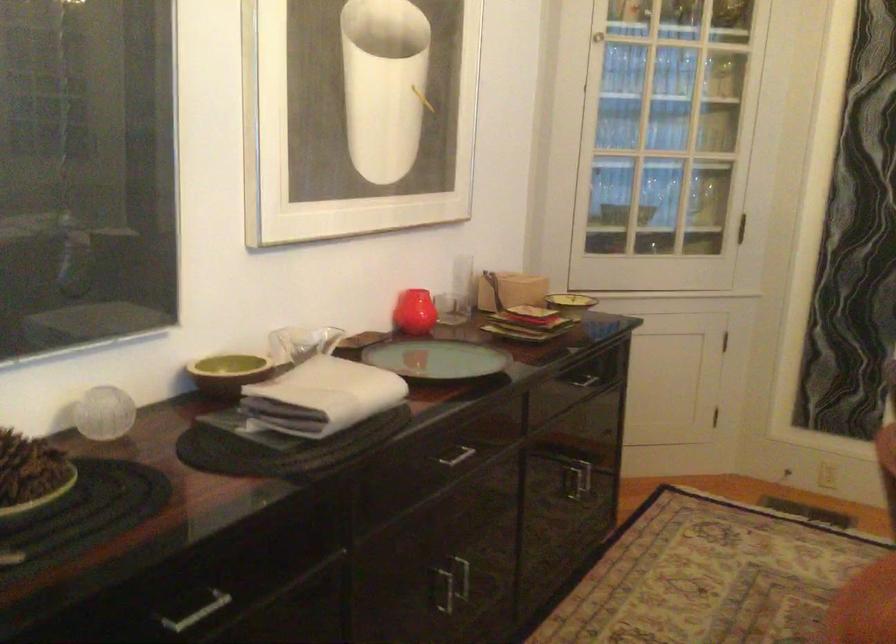
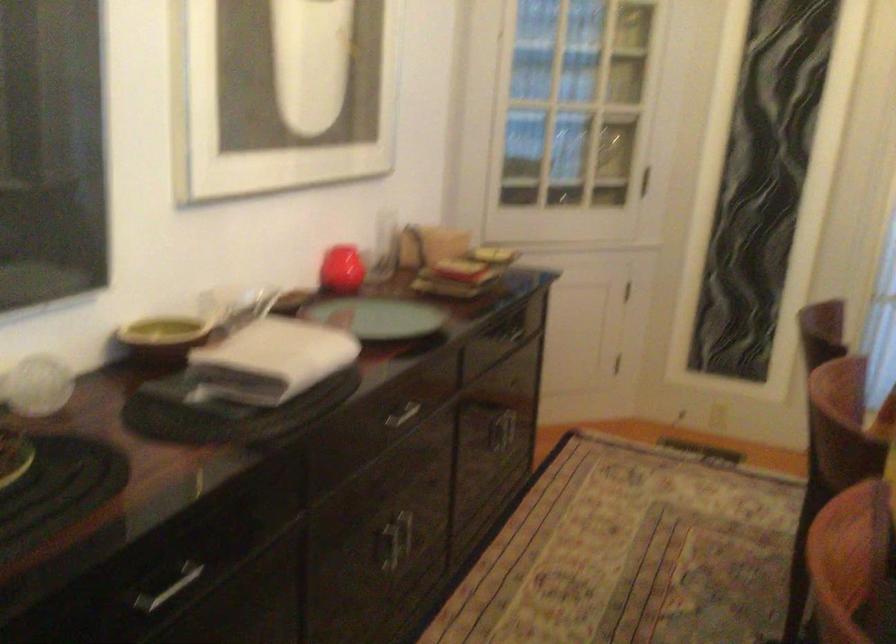
Question: The images are taken continuously from a first-person perspective. In which direction is your viewpoint rotating?

Choices:
 (A) Left
 (B) Right
 (C) Up
 (D) Down

Answer: (B)